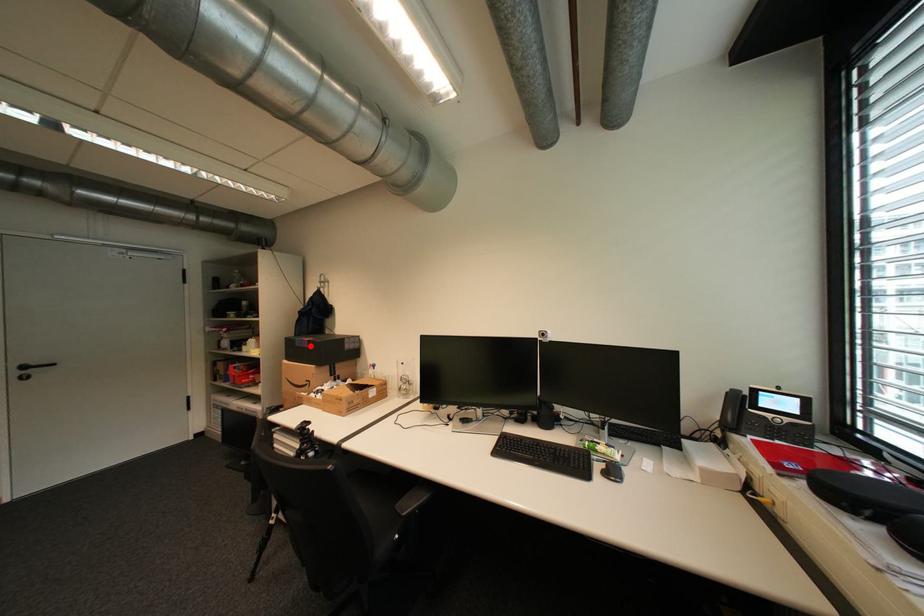
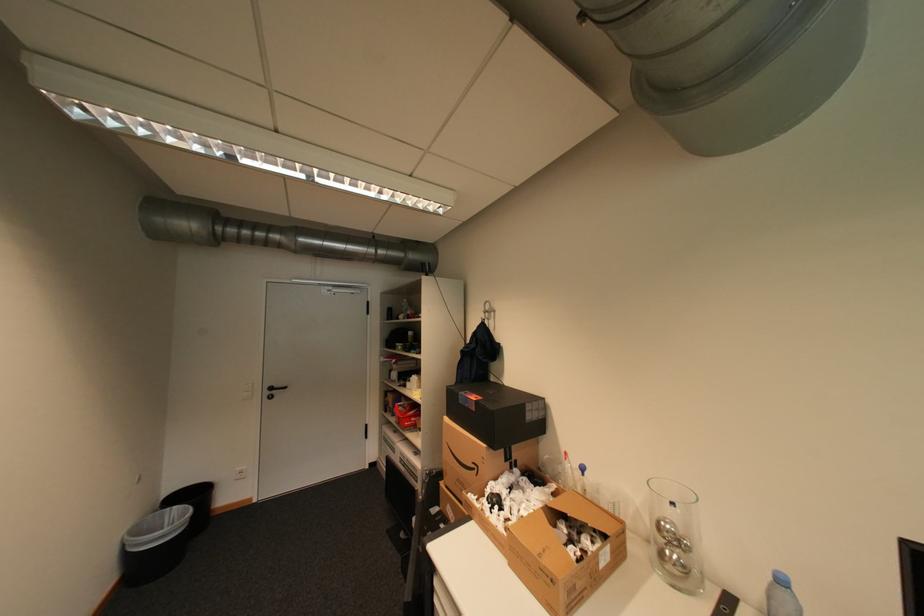
Question: I am providing you with two images of the same scene from different viewpoints. A red point is marked on the first image. Can you still see the location of the red point in image 2?

Choices:
 (A) Yes
 (B) No

Answer: (A)